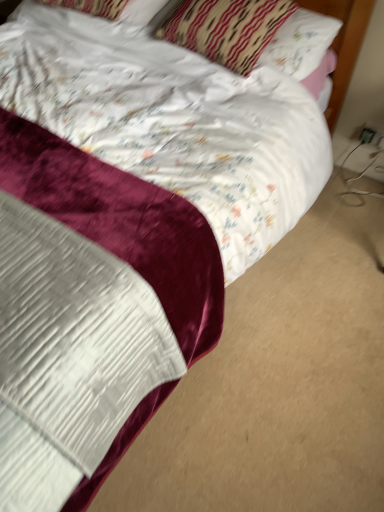
Question: Does black plastic outlet at lower right, which ranks as the 2th electric outlet in right-to-left order, have a lesser height compared to white plastic electric outlet at lower right, marked as the first electric outlet in a right-to-left arrangement?

Choices:
 (A) yes
 (B) no

Answer: (A)

Question: Could white plastic electric outlet at lower right, which appears as the 2th electric outlet when viewed from the left, be considered to be inside black plastic outlet at lower right, the 1th electric outlet positioned from the left?

Choices:
 (A) no
 (B) yes

Answer: (A)

Question: Is black plastic outlet at lower right, the 1th electric outlet positioned from the left, not within white plastic electric outlet at lower right, marked as the first electric outlet in a right-to-left arrangement?

Choices:
 (A) no
 (B) yes

Answer: (B)

Question: From a real-world perspective, is black plastic outlet at lower right, the 1th electric outlet positioned from the left, positioned under white plastic electric outlet at lower right, marked as the first electric outlet in a right-to-left arrangement, based on gravity?

Choices:
 (A) no
 (B) yes

Answer: (A)

Question: Does black plastic outlet at lower right, the 1th electric outlet positioned from the left, have a larger size compared to white plastic electric outlet at lower right, marked as the first electric outlet in a right-to-left arrangement?

Choices:
 (A) yes
 (B) no

Answer: (B)

Question: Considering the positions of point (370, 137) and point (150, 12), is point (370, 137) closer or farther from the camera than point (150, 12)?

Choices:
 (A) closer
 (B) farther

Answer: (B)

Question: Is white plastic electric outlet at lower right, marked as the first electric outlet in a right-to-left arrangement, bigger or smaller than white satin pillow at upper center, which is counted as the 1th pillow, starting from the left?

Choices:
 (A) small
 (B) big

Answer: (A)

Question: Considering the positions of white plastic electric outlet at lower right, marked as the first electric outlet in a right-to-left arrangement, and white satin pillow at upper center, which is the 2th pillow from right to left, in the image, is white plastic electric outlet at lower right, marked as the first electric outlet in a right-to-left arrangement, wider or thinner than white satin pillow at upper center, which is the 2th pillow from right to left,?

Choices:
 (A) wide
 (B) thin

Answer: (B)

Question: Considering the positions of white plastic electric outlet at lower right, marked as the first electric outlet in a right-to-left arrangement, and white satin pillow at upper center, which is counted as the 1th pillow, starting from the left, in the image, is white plastic electric outlet at lower right, marked as the first electric outlet in a right-to-left arrangement, taller or shorter than white satin pillow at upper center, which is counted as the 1th pillow, starting from the left,?

Choices:
 (A) short
 (B) tall

Answer: (A)

Question: In terms of size, does patterned fabric pillow at upper center, which appears as the 2th pillow when viewed from the left, appear bigger or smaller than black plastic outlet at lower right, the 1th electric outlet positioned from the left?

Choices:
 (A) small
 (B) big

Answer: (B)

Question: From their relative heights in the image, would you say patterned fabric pillow at upper center, which appears as the 2th pillow when viewed from the left, is taller or shorter than black plastic outlet at lower right, the 1th electric outlet positioned from the left?

Choices:
 (A) short
 (B) tall

Answer: (B)

Question: Considering their positions, is patterned fabric pillow at upper center, which appears as the 2th pillow when viewed from the left, located in front of or behind black plastic outlet at lower right, which ranks as the 2th electric outlet in right-to-left order?

Choices:
 (A) behind
 (B) front

Answer: (B)

Question: Choose the correct answer: Is patterned fabric pillow at upper center, which is the first pillow in right-to-left order, inside black plastic outlet at lower right, the 1th electric outlet positioned from the left, or outside it?

Choices:
 (A) outside
 (B) inside

Answer: (A)

Question: Would you say patterned fabric pillow at upper center, which is the first pillow in right-to-left order, is to the left or to the right of white plastic electric outlet at lower right, marked as the first electric outlet in a right-to-left arrangement, in the picture?

Choices:
 (A) right
 (B) left

Answer: (B)

Question: From a real-world perspective, is patterned fabric pillow at upper center, which appears as the 2th pillow when viewed from the left, above or below white plastic electric outlet at lower right, which appears as the 2th electric outlet when viewed from the left?

Choices:
 (A) below
 (B) above

Answer: (B)